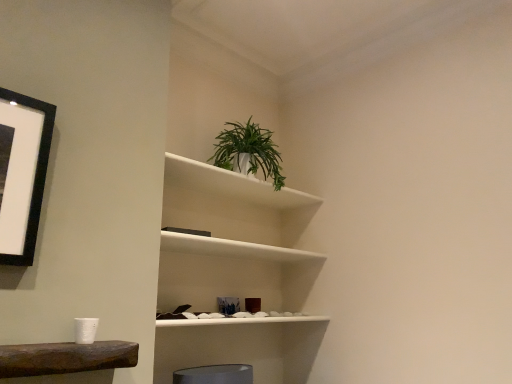
Question: Considering the positions of white matte plant at upper center and green leafy plant in white pot at upper center in the image, is white matte plant at upper center taller or shorter than green leafy plant in white pot at upper center?

Choices:
 (A) tall
 (B) short

Answer: (A)

Question: Is white matte plant at upper center wider or thinner than green leafy plant in white pot at upper center?

Choices:
 (A) thin
 (B) wide

Answer: (B)

Question: Visually, is white matte plant at upper center positioned to the left or to the right of green leafy plant in white pot at upper center?

Choices:
 (A) left
 (B) right

Answer: (A)

Question: Based on their positions, is green leafy plant in white pot at upper center located to the left or right of white matte plant at upper center?

Choices:
 (A) right
 (B) left

Answer: (A)

Question: Considering the positions of green leafy plant in white pot at upper center and white matte plant at upper center in the image, is green leafy plant in white pot at upper center bigger or smaller than white matte plant at upper center?

Choices:
 (A) big
 (B) small

Answer: (B)

Question: Considering the positions of point (275, 180) and point (218, 251), is point (275, 180) closer or farther from the camera than point (218, 251)?

Choices:
 (A) closer
 (B) farther

Answer: (A)

Question: Is green leafy plant in white pot at upper center taller or shorter than white matte plant at upper center?

Choices:
 (A) short
 (B) tall

Answer: (A)